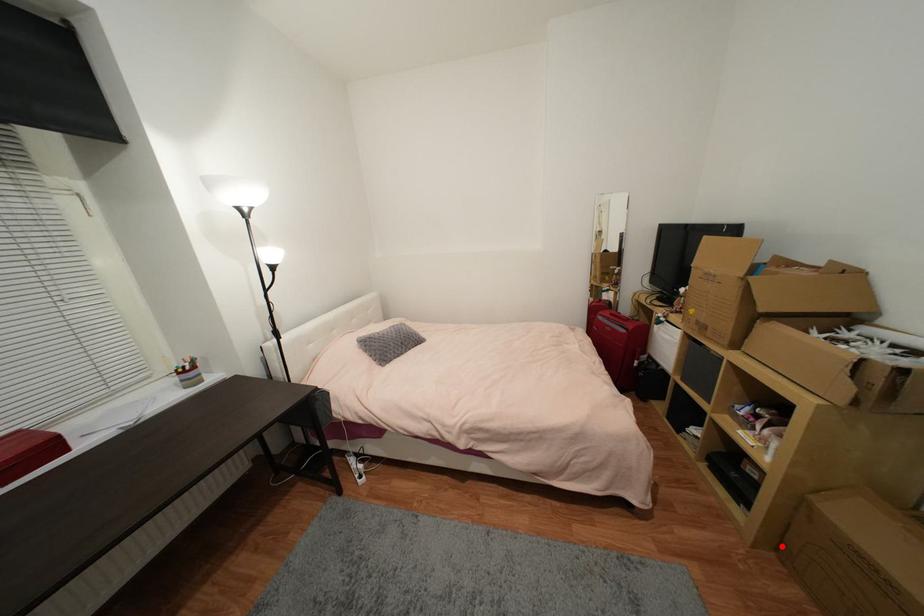
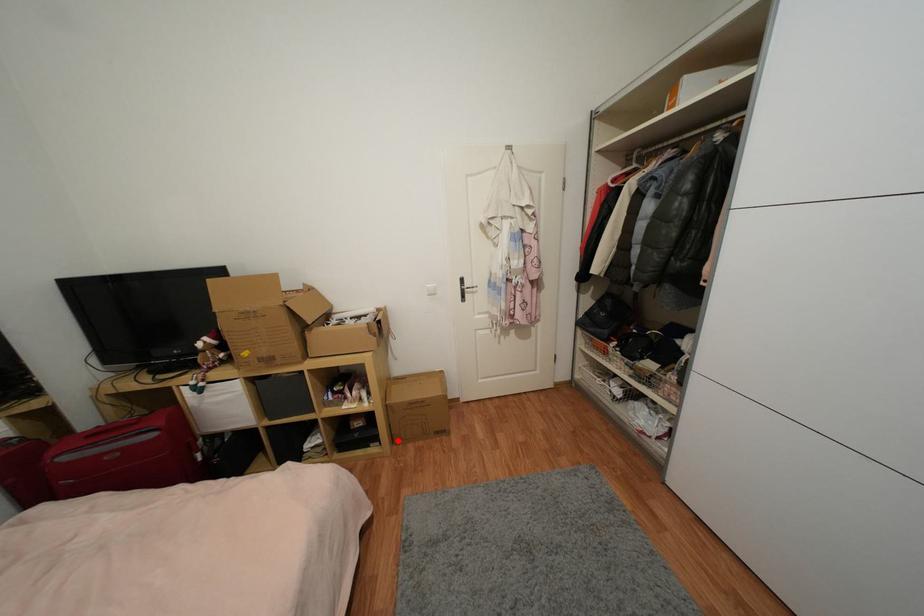
I am providing you with two images of the same scene from different viewpoints. A red point is marked on the first image and another point is marked on the second image. Are the points marked in image1 and image2 representing the same 3D position?

Yes